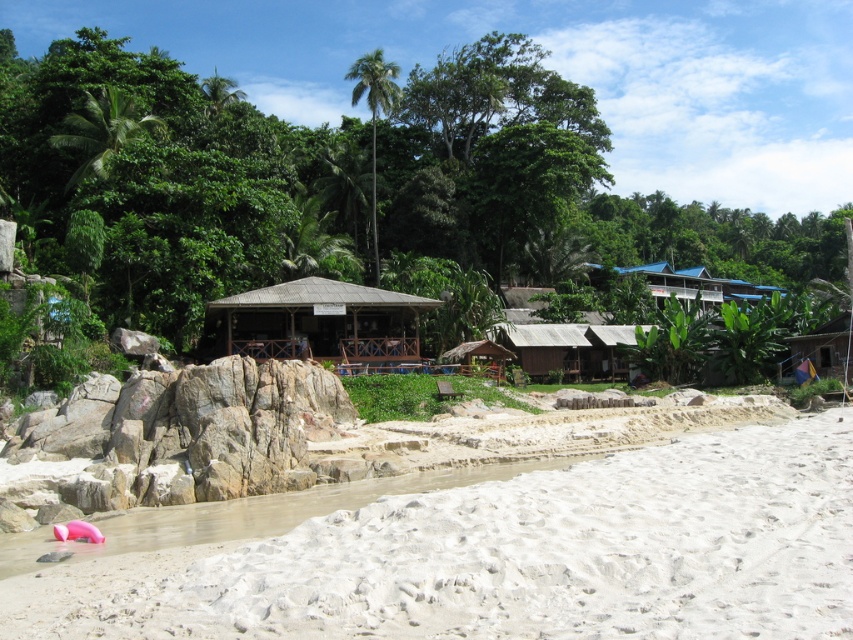
Is brown wooden hut at center further to the viewer compared to wooden hut at right?

No, brown wooden hut at center is in front of wooden hut at right.

Does brown wooden hut at center have a larger size compared to wooden hut at right?

Correct, brown wooden hut at center is larger in size than wooden hut at right.

Describe the element at coordinates (322, 321) in the screenshot. I see `brown wooden hut at center` at that location.

The height and width of the screenshot is (640, 853). I want to click on brown wooden hut at center, so click(322, 321).

Is white sandy beach at lower left above wooden hut at right?

No.

Who is more distant from viewer, (126,634) or (846,376)?

Positioned behind is point (846,376).

You are a GUI agent. You are given a task and a screenshot of the screen. Output one action in this format:
    pyautogui.click(x=<x>, y=<y>)
    Task: Click on the white sandy beach at lower left
    This screenshot has height=640, width=853.
    Given the screenshot: What is the action you would take?
    pyautogui.click(x=514, y=556)

Is white sandy beach at lower left taller than brown wooden hut at center?

No.

Does white sandy beach at lower left appear under brown wooden hut at center?

Yes.

Locate an element on the screen. The height and width of the screenshot is (640, 853). white sandy beach at lower left is located at coordinates point(514,556).

Find the location of `white sandy beach at lower left`. white sandy beach at lower left is located at coordinates (514, 556).